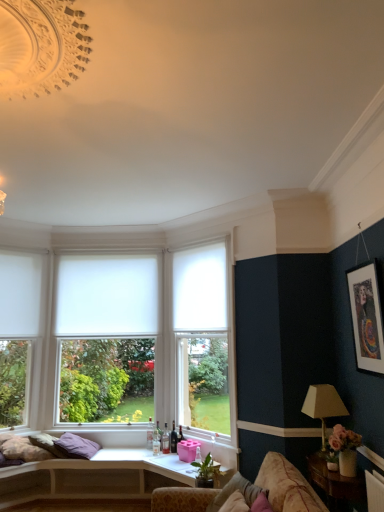
Locate an element on the screen. The image size is (384, 512). vacant area on top of white matte curtain at left, the 2th curtain when ordered from right to left (from a real-world perspective) is located at coordinates (19, 250).